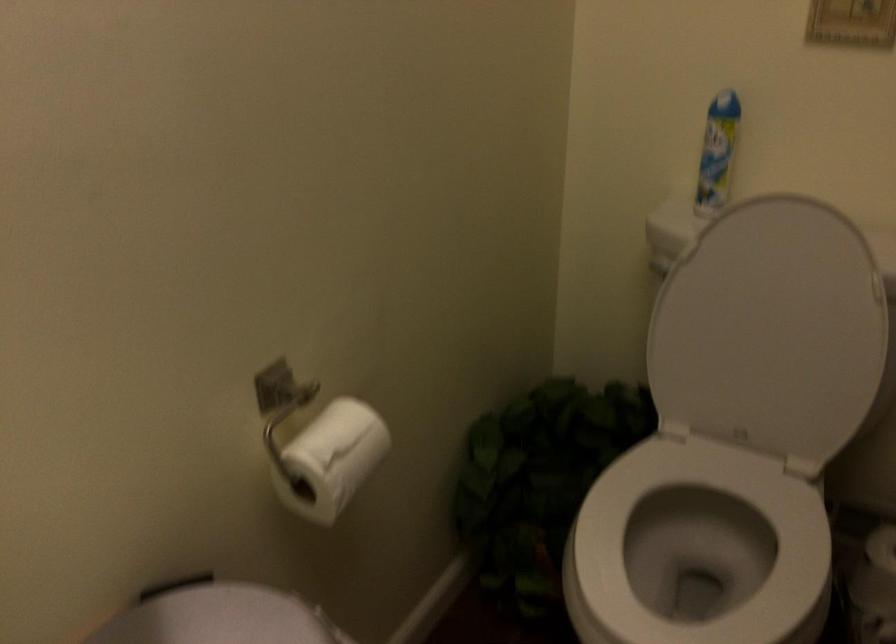
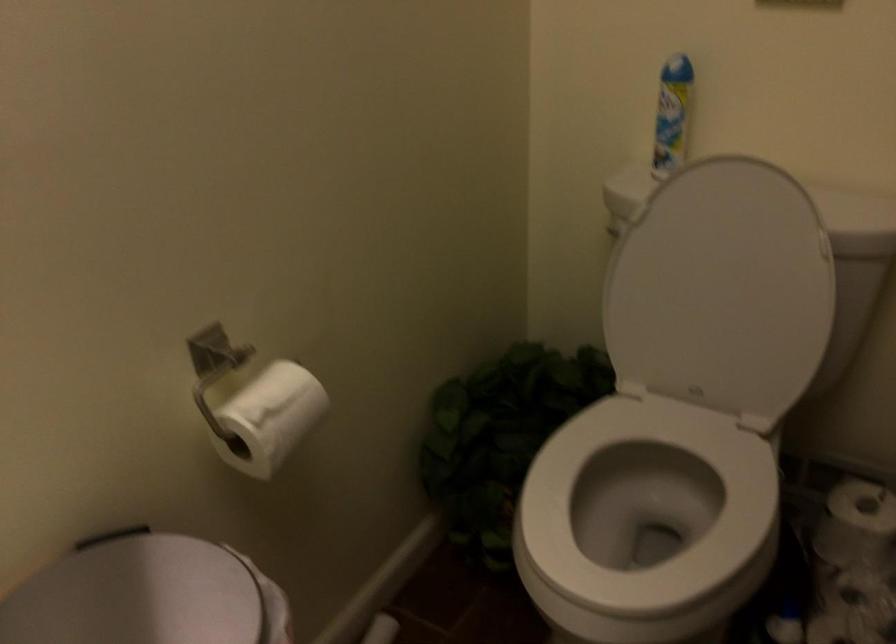
Question: The images are taken continuously from a first-person perspective. In which direction is your viewpoint rotating?

Choices:
 (A) Left
 (B) Right
 (C) Up
 (D) Down

Answer: (D)